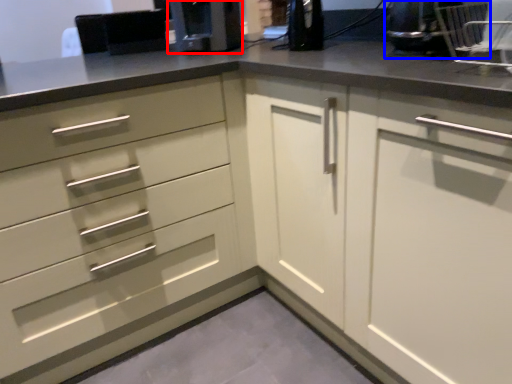
Question: Which point is closer to the camera, coffee machine (highlighted by a red box) or appliance (highlighted by a blue box)?

Choices:
 (A) coffee machine
 (B) appliance

Answer: (B)